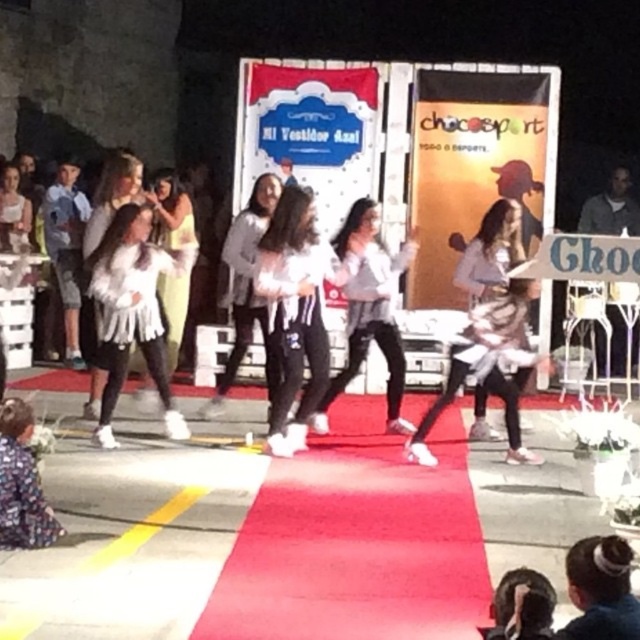
You are a photographer at the event and need to capture both the white matte pants at center and the white textured dress at center in a single frame. Given their sizes, which one should you focus on to ensure both are clearly visible?

The white matte pants at center has a larger size compared to the white textured dress at center. To ensure both are clearly visible, focus on the white matte pants at center since it is larger and will be easier to frame without cropping the smaller dress.

You are a photographer at the event and need to capture a photo of both the white fluffy dress at center and the white fuzzy coat at center. Since the camera has a limited focus range, you need to know which object is narrower to ensure proper framing. Which one is narrower?

The white fluffy dress at center is narrower than the white fuzzy coat at center, so you should frame the photo to focus on the narrower white fluffy dress at center first.

You are a photographer at the event and want to capture both the white fluffy dress at center and the white fuzzy coat at center in a single photo. Based on their positions, which one should you focus on first to ensure both are in frame?

The white fluffy dress at center is below the white fuzzy coat at center, so you should focus on the white fuzzy coat at center first to ensure both are in frame.